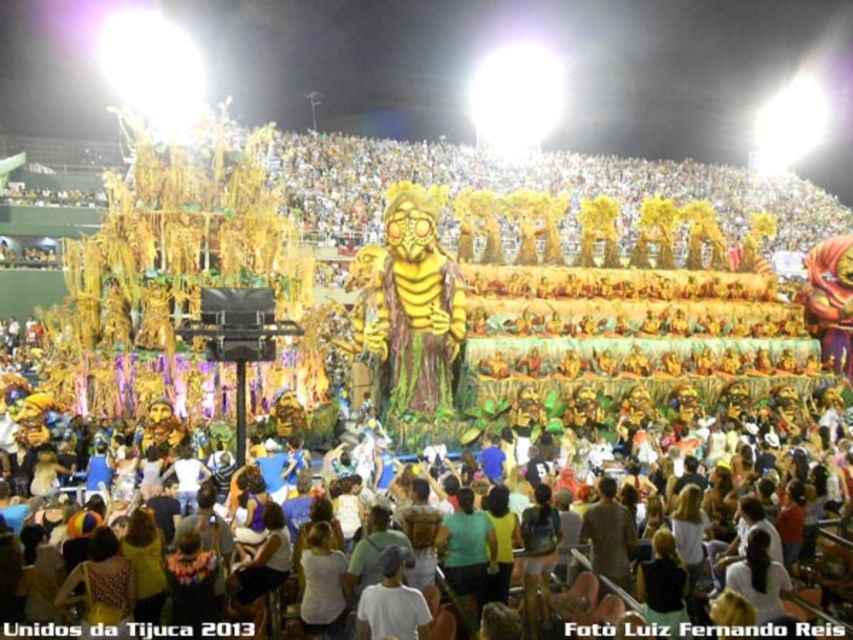
Question: Does multicolored carnival costumes at center appear over gold metallic mask at center?

Choices:
 (A) yes
 (B) no

Answer: (B)

Question: Which of the following is the farthest from the observer?

Choices:
 (A) multicolored carnival costumes at center
 (B) gold metallic mask at center

Answer: (B)

Question: Does multicolored carnival costumes at center appear over gold metallic mask at center?

Choices:
 (A) no
 (B) yes

Answer: (A)

Question: Does multicolored carnival costumes at center have a lesser width compared to gold metallic mask at center?

Choices:
 (A) no
 (B) yes

Answer: (A)

Question: Which point appears farthest from the camera in this image?

Choices:
 (A) (781, 556)
 (B) (358, 330)

Answer: (B)